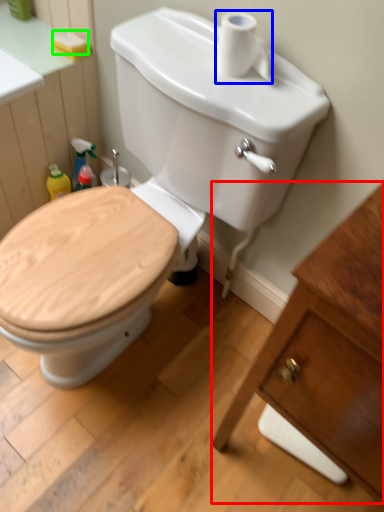
Question: Based on their relative distances, which object is farther from porcelain (highlighted by a red box)? Choose from toilet paper (highlighted by a blue box) and soap (highlighted by a green box).

Choices:
 (A) toilet paper
 (B) soap

Answer: (B)